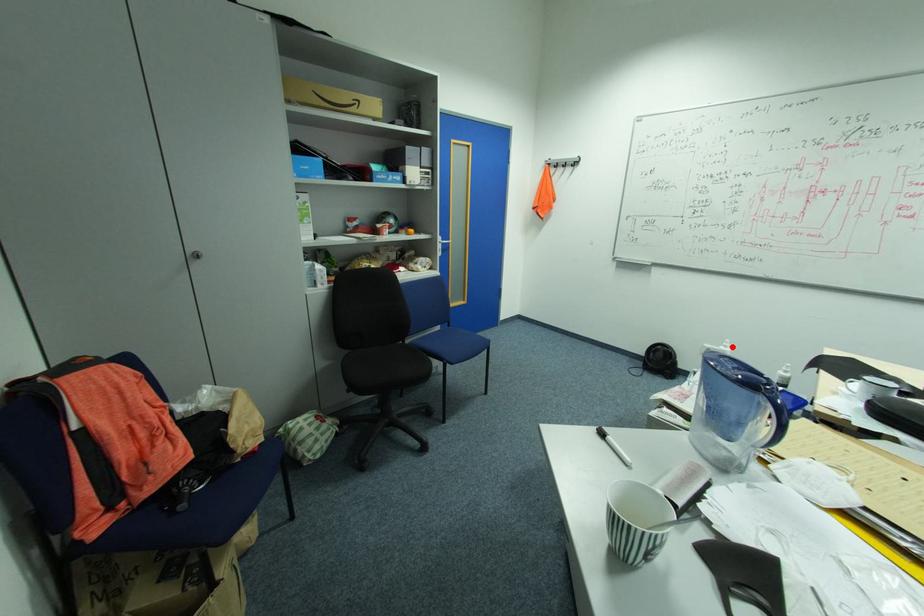
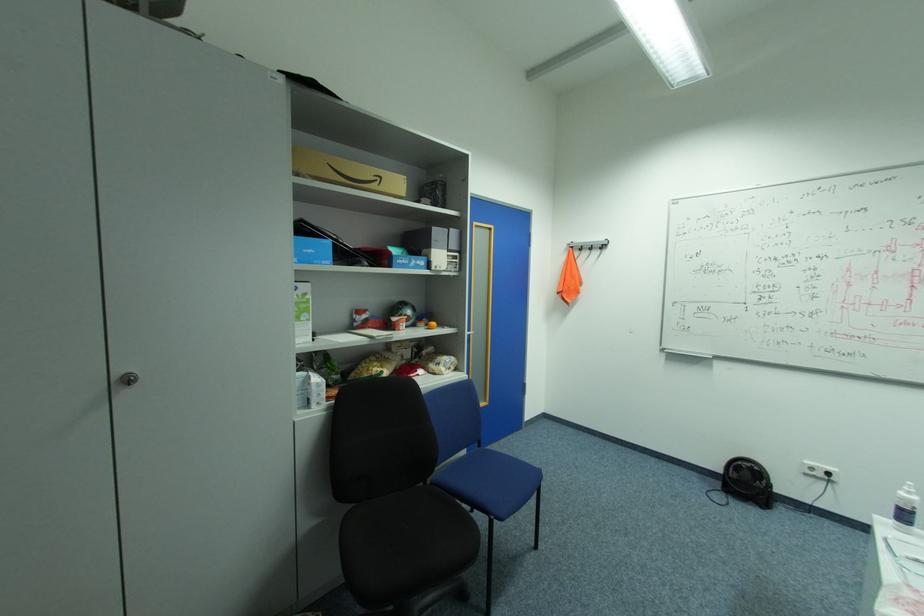
Question: I am providing you with two images of the same scene from different viewpoints. A red point is shown in image1. For the corresponding object point in image2, is it positioned nearer or farther from the camera?

Choices:
 (A) Nearer
 (B) Farther

Answer: (B)